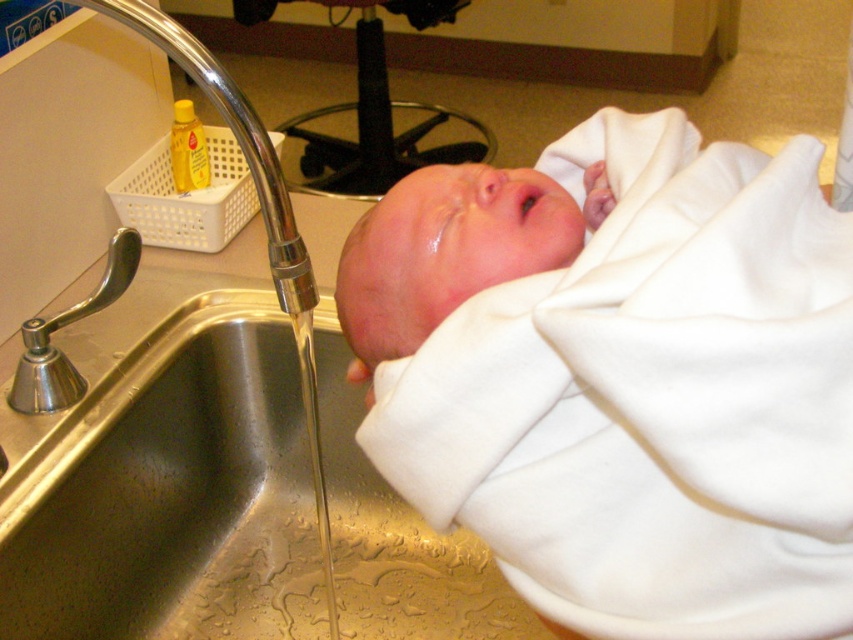
From the picture: You are a caregiver holding the white cotton newborn at center near the stainless steel sink at center. The baby needs to be moved to a warmer area. Which direction should you move the baby relative to the sink to keep it warm?

The white cotton newborn at center is located below the stainless steel sink at center. To keep the baby warm, you should move it upward away from the sink since it is currently positioned below the sink, which may be cooler due to the water flow.

You are a caregiver holding the white cotton newborn at center over the stainless steel sink at center to give a bath. The water from the faucet is running. Which side of the sink should you turn to avoid the water hitting the newborn directly?

The white cotton newborn at center is on the right side of the stainless steel sink at center. To avoid the water hitting the newborn directly, turn the faucet to the left side of the sink away from the newborn.